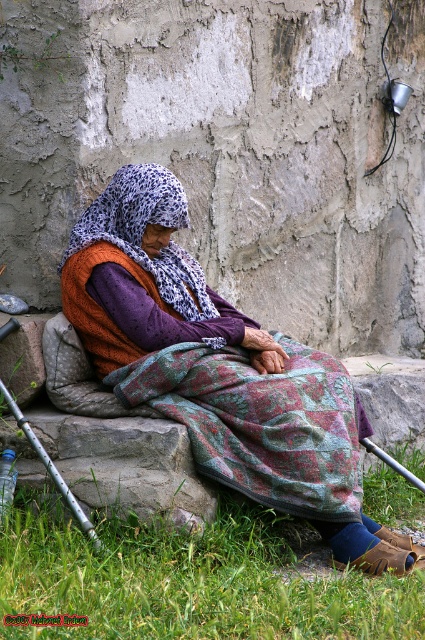
You are taking a photo of the scene and want to focus on both point [142,244] and point [164,273]. Which point should you focus on first to ensure both are in sharp focus?

Point [142,244] is closer to the camera than point [164,273]. To ensure both are in sharp focus, you should focus on the closer point first, which is point [142,244].

You are an anthropologist studying traditional attire. You observe the elderly woman in the scene and note the patterned fabric headscarf at center. Where is this headscarf positioned relative to the weathered wall and the metallic object on the wall to the right?

The patterned fabric headscarf at center is located at point (218, 368), which places it centrally on the woman, between the weathered wall behind her and the metallic object mounted on the wall to her right.